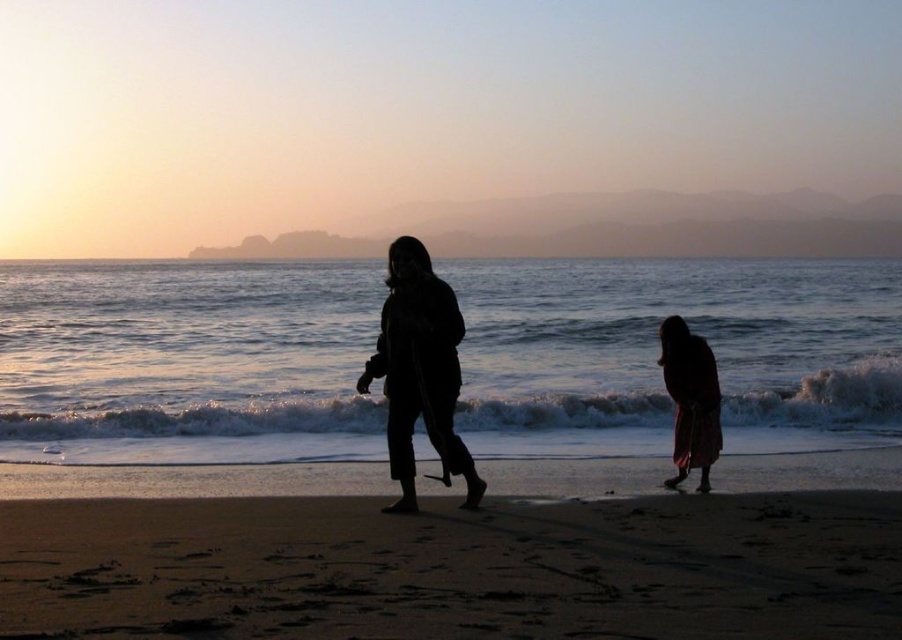
Does dark sand at lower center come behind silhouette coat at center?

No, dark sand at lower center is closer to the viewer.

Is point (764, 602) closer to camera compared to point (434, 394)?

Yes, it is in front of point (434, 394).

Locate an element on the screen. Image resolution: width=902 pixels, height=640 pixels. dark sand at lower center is located at coordinates (453, 570).

Which of these two, silhouette coat at center or silhouette fabric at lower right, stands taller?

With more height is silhouette coat at center.

Who is positioned more to the left, silhouette coat at center or silhouette fabric at lower right?

From the viewer's perspective, silhouette coat at center appears more on the left side.

Who is more distant from viewer, [456,337] or [704,406]?

The point [704,406] is behind.

Image resolution: width=902 pixels, height=640 pixels. Find the location of `silhouette coat at center`. silhouette coat at center is located at coordinates (419, 371).

Is dark sand at lower center further to the viewer compared to silhouette fabric at lower right?

No.

Is point (586, 513) in front of point (682, 396)?

Yes, it is in front of point (682, 396).

Does point (640, 589) come behind point (703, 346)?

No, it is not.

What are the coordinates of `dark sand at lower center` in the screenshot? It's located at (453, 570).